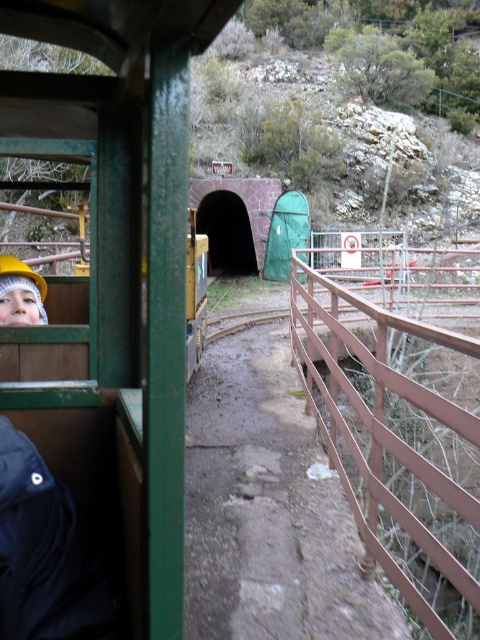
Question: Is metallic green train at left smaller than brown metal fence at right?

Choices:
 (A) yes
 (B) no

Answer: (A)

Question: Which point is closer to the camera taking this photo?

Choices:
 (A) (219, 202)
 (B) (372, 308)

Answer: (B)

Question: Which point is closer to the camera?

Choices:
 (A) metallic green train at left
 (B) brown metal fence at right
 (C) hard hat at left
 (D) green matte tunnel at center

Answer: (A)

Question: Which point is farther to the camera?

Choices:
 (A) brown metal fence at right
 (B) green matte tunnel at center
 (C) hard hat at left

Answer: (B)

Question: Does green matte tunnel at center lie behind hard hat at left?

Choices:
 (A) yes
 (B) no

Answer: (A)

Question: Is brown metal fence at right below green matte tunnel at center?

Choices:
 (A) no
 (B) yes

Answer: (B)